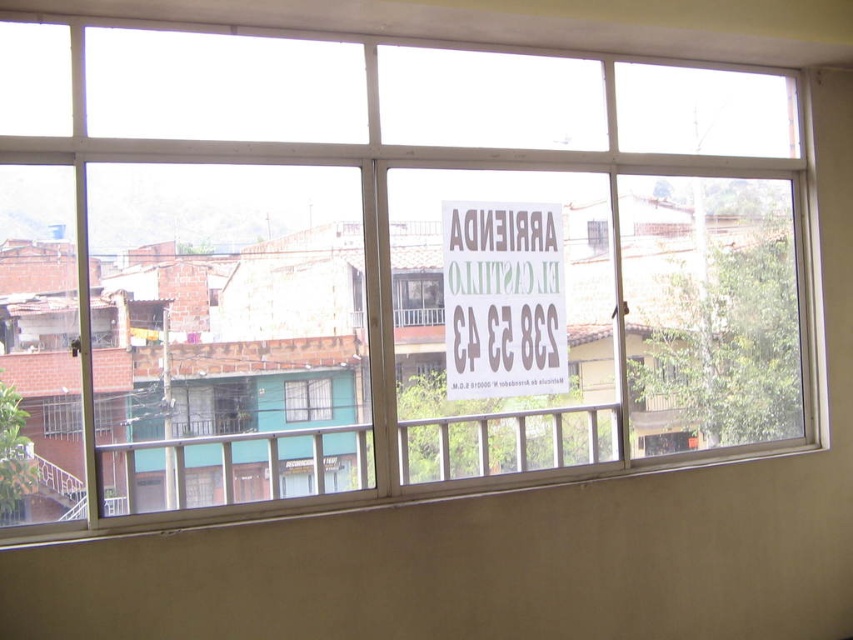
Which is in front, point (540, 312) or point (309, 400)?

Point (309, 400)

Who is more forward, (544, 252) or (331, 397)?

Positioned in front is point (331, 397).

Where is `brown cardboard sign at center`? brown cardboard sign at center is located at coordinates (503, 300).